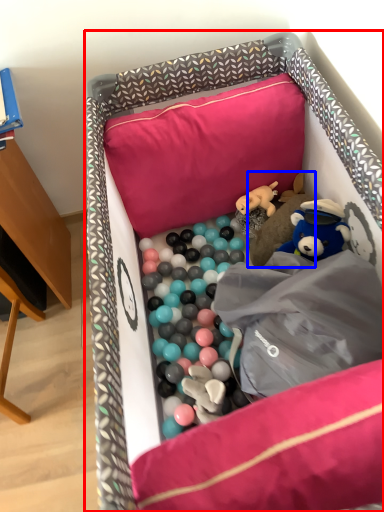
Question: Which object is further to the camera taking this photo, infant bed (highlighted by a red box) or toy (highlighted by a blue box)?

Choices:
 (A) infant bed
 (B) toy

Answer: (B)